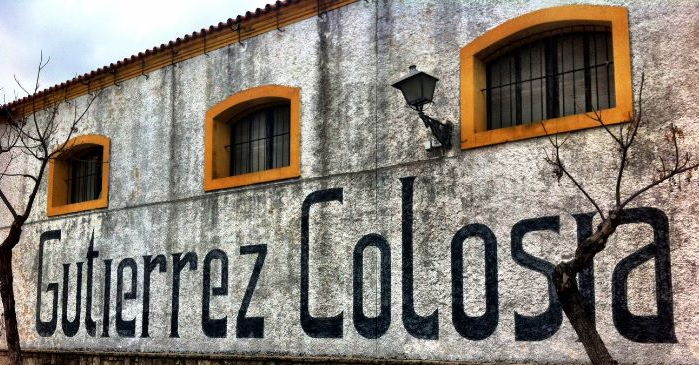
You are a GUI agent. You are given a task and a screenshot of the screen. Output one action in this format:
    pyautogui.click(x=<x>, y=<y>)
    Task: Click on the light
    The height and width of the screenshot is (365, 699).
    Given the screenshot: What is the action you would take?
    pyautogui.click(x=409, y=88)